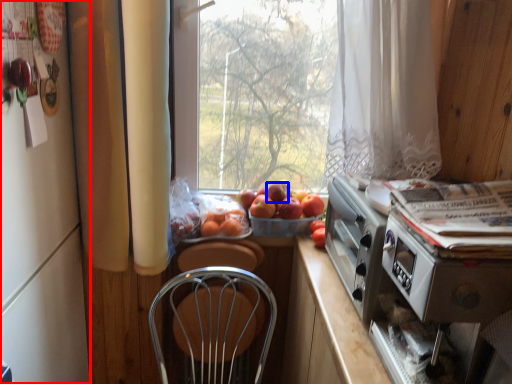
Question: Which point is further to the camera, fridge (highlighted by a red box) or apple (highlighted by a blue box)?

Choices:
 (A) fridge
 (B) apple

Answer: (B)